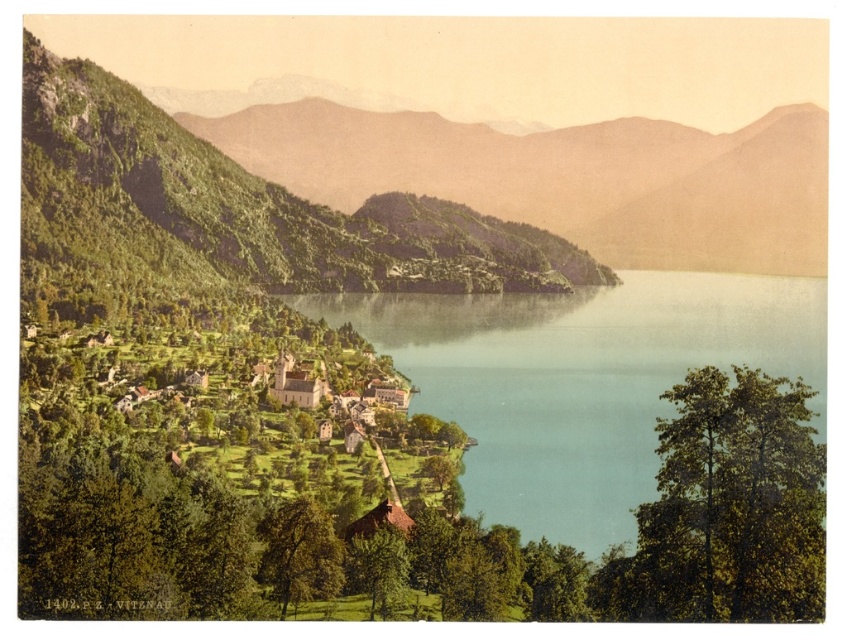
Question: Can you confirm if blue water at center is wider than green leafy tree at lower right?

Choices:
 (A) no
 (B) yes

Answer: (B)

Question: Among these objects, which one is nearest to the camera?

Choices:
 (A) blue water at center
 (B) green matte tree at center
 (C) green grassy hillside at center

Answer: (A)

Question: Which object is the closest to the blue water at center?

Choices:
 (A) green grassy hillside at center
 (B) green matte tree at center
 (C) green matte tree at lower left

Answer: (A)

Question: Which object is farther from the camera taking this photo?

Choices:
 (A) green leafy tree at lower right
 (B) blue water at center
 (C) green grassy hillside at center

Answer: (C)

Question: Observing the image, what is the correct spatial positioning of green grassy hillside at center in reference to green matte tree at lower left?

Choices:
 (A) right
 (B) left

Answer: (A)

Question: Is green grassy hillside at center closer to camera compared to green matte tree at lower left?

Choices:
 (A) yes
 (B) no

Answer: (B)